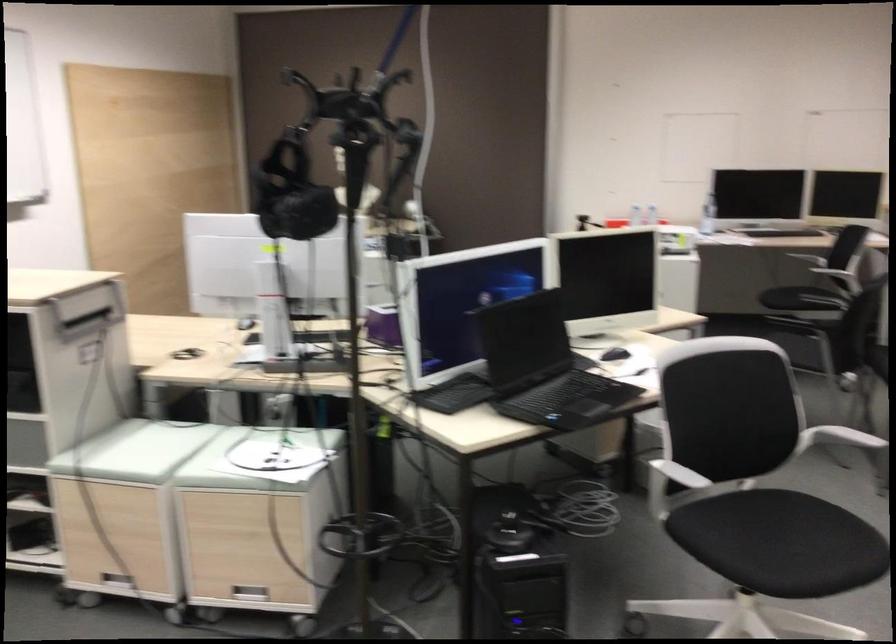
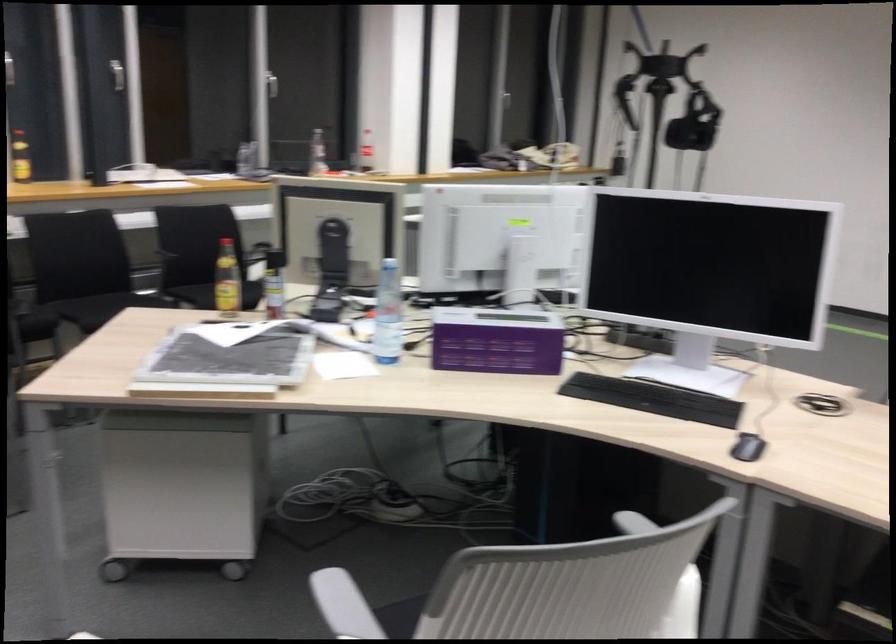
Question: I am providing you with two images of the same scene from different viewpoints. Which of the following objects are not visible in image2?

Choices:
 (A) blue hole punch lever
 (B) white chair armrest
 (C) black computer mouse
 (D) phone handset

Answer: (B)